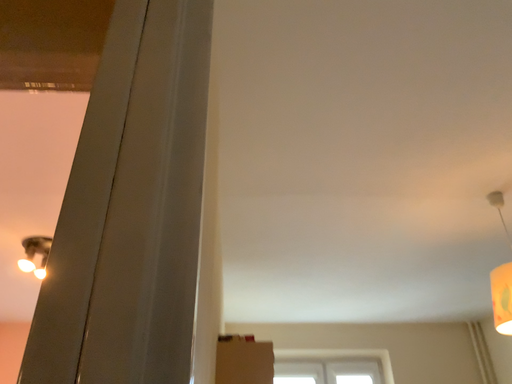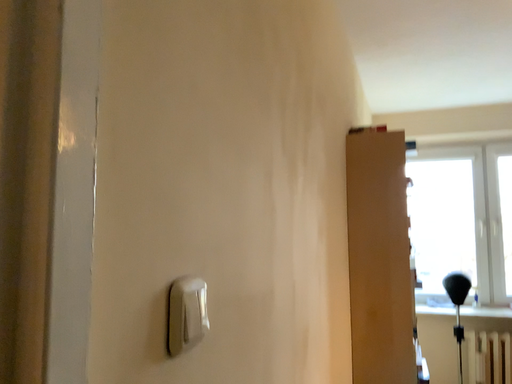
Question: How did the camera likely rotate when shooting the video?

Choices:
 (A) rotated right
 (B) rotated left

Answer: (B)